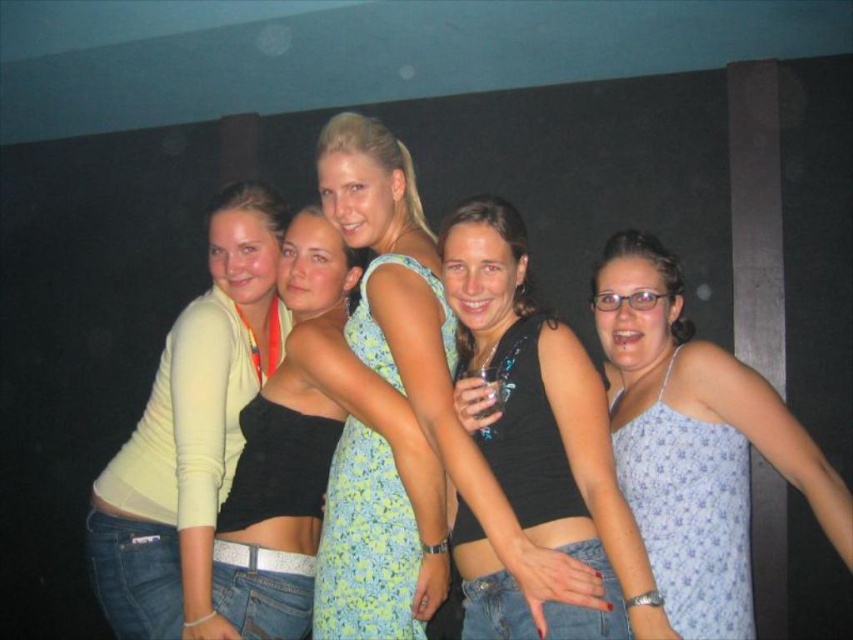
Question: Is light blue printed tank top at center to the left of black sequined tank top at center from the viewer's perspective?

Choices:
 (A) no
 (B) yes

Answer: (A)

Question: Which object appears closest to the camera in this image?

Choices:
 (A) black sequined tank top at center
 (B) floral dress at center

Answer: (A)

Question: Is black sequined tank top at center behind light blue floral dress at center?

Choices:
 (A) yes
 (B) no

Answer: (B)

Question: Which object is farther from the camera taking this photo?

Choices:
 (A) light blue floral dress at center
 (B) light blue printed tank top at center
 (C) floral dress at center

Answer: (A)

Question: Is floral dress at center closer to camera compared to black sequined tank top at center?

Choices:
 (A) yes
 (B) no

Answer: (B)

Question: Which point appears closest to the camera in this image?

Choices:
 (A) (532, 349)
 (B) (439, 481)
 (C) (376, 202)
 (D) (114, 595)

Answer: (A)